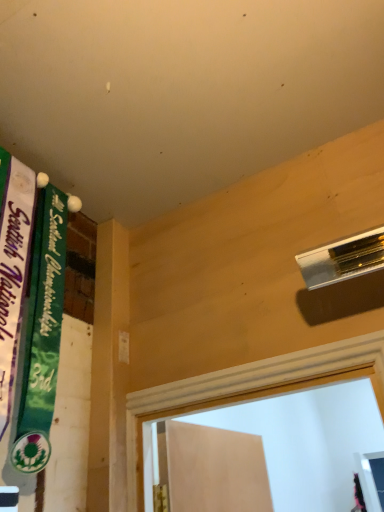
Question: Is green fabric banner at left, which appears as the second bulletin board when viewed from the right, beside green fabric banner at upper left, which is counted as the 2th bulletin board, starting from the left?

Choices:
 (A) yes
 (B) no

Answer: (A)

Question: From the image's perspective, is green fabric banner at left, which appears as the second bulletin board when viewed from the right, under green fabric banner at upper left, which is counted as the 2th bulletin board, starting from the left?

Choices:
 (A) no
 (B) yes

Answer: (A)

Question: Is green fabric banner at left, placed as the first bulletin board when sorted from left to right, far away from green fabric banner at upper left, placed as the first bulletin board when sorted from right to left?

Choices:
 (A) no
 (B) yes

Answer: (A)

Question: Can you confirm if green fabric banner at left, placed as the first bulletin board when sorted from left to right, is thinner than green fabric banner at upper left, placed as the first bulletin board when sorted from right to left?

Choices:
 (A) yes
 (B) no

Answer: (A)

Question: From the image's perspective, is green fabric banner at left, which appears as the second bulletin board when viewed from the right, above green fabric banner at upper left, which is counted as the 2th bulletin board, starting from the left?

Choices:
 (A) yes
 (B) no

Answer: (A)

Question: Is green fabric banner at left, placed as the first bulletin board when sorted from left to right, bigger than green fabric banner at upper left, placed as the first bulletin board when sorted from right to left?

Choices:
 (A) no
 (B) yes

Answer: (B)

Question: Does green fabric banner at upper left, placed as the first bulletin board when sorted from right to left, turn towards green fabric banner at left, placed as the first bulletin board when sorted from left to right?

Choices:
 (A) no
 (B) yes

Answer: (A)

Question: From the image's perspective, is green fabric banner at upper left, which is counted as the 2th bulletin board, starting from the left, on top of green fabric banner at left, placed as the first bulletin board when sorted from left to right?

Choices:
 (A) no
 (B) yes

Answer: (A)

Question: From a real-world perspective, is green fabric banner at upper left, placed as the first bulletin board when sorted from right to left, located higher than green fabric banner at left, placed as the first bulletin board when sorted from left to right?

Choices:
 (A) no
 (B) yes

Answer: (B)

Question: Is green fabric banner at upper left, which is counted as the 2th bulletin board, starting from the left, thinner than green fabric banner at left, placed as the first bulletin board when sorted from left to right?

Choices:
 (A) no
 (B) yes

Answer: (A)

Question: Is green fabric banner at upper left, which is counted as the 2th bulletin board, starting from the left, positioned in front of green fabric banner at left, placed as the first bulletin board when sorted from left to right?

Choices:
 (A) no
 (B) yes

Answer: (A)

Question: Does green fabric banner at upper left, which is counted as the 2th bulletin board, starting from the left, have a lesser height compared to green fabric banner at left, which appears as the second bulletin board when viewed from the right?

Choices:
 (A) no
 (B) yes

Answer: (B)

Question: Does point (6, 350) appear closer or farther from the camera than point (39, 248)?

Choices:
 (A) farther
 (B) closer

Answer: (B)